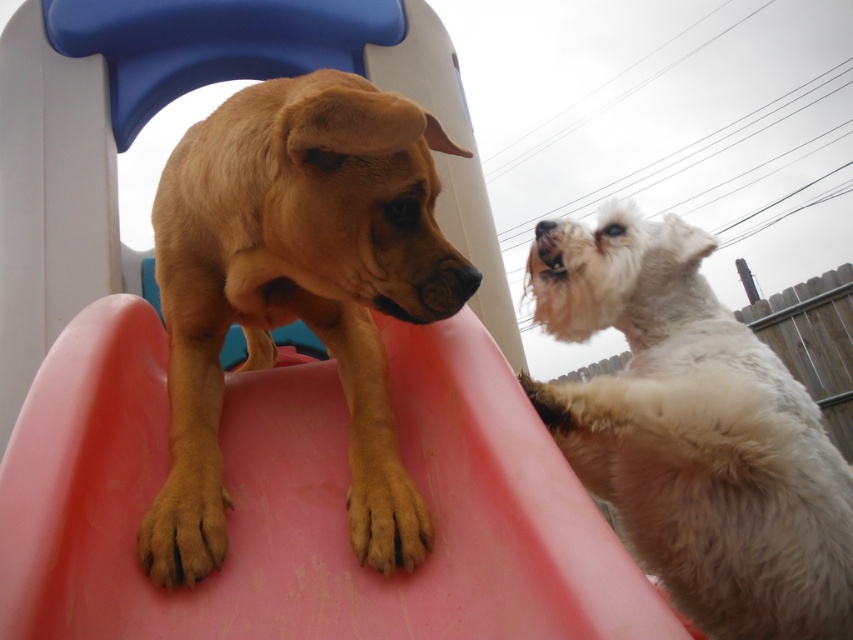
Question: Is pink plastic slide at center thinner than white fur nose at upper center?

Choices:
 (A) no
 (B) yes

Answer: (A)

Question: Among these objects, which one is nearest to the camera?

Choices:
 (A) pink plastic slide at center
 (B) brown matte paw at lower center
 (C) white fluffy dog at upper right
 (D) brown fur paw at lower left

Answer: (A)

Question: Does white fluffy dog at upper right appear under white fur nose at upper center?

Choices:
 (A) yes
 (B) no

Answer: (A)

Question: Which point appears closest to the camera in this image?

Choices:
 (A) (173, 531)
 (B) (514, 572)
 (C) (537, 225)
 (D) (686, 486)

Answer: (B)

Question: Which object appears farthest from the camera in this image?

Choices:
 (A) brown matte paw at lower center
 (B) pink plastic slide at center

Answer: (A)

Question: Can you confirm if golden brown fur at center is smaller than white fur nose at upper center?

Choices:
 (A) yes
 (B) no

Answer: (B)